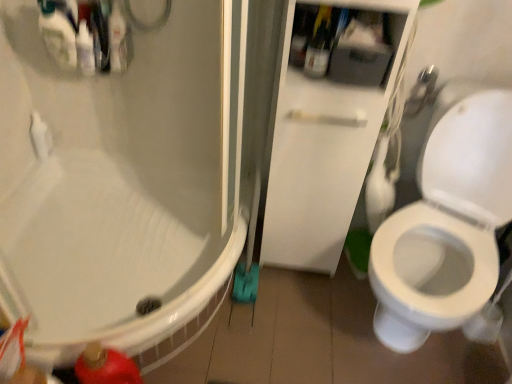
Question: Is brushed metal showerhead at upper right oriented away from translucent plastic bottle at upper center?

Choices:
 (A) no
 (B) yes

Answer: (A)

Question: Can you confirm if brushed metal showerhead at upper right is bigger than translucent plastic bottle at upper center?

Choices:
 (A) no
 (B) yes

Answer: (B)

Question: Is brushed metal showerhead at upper right far from translucent plastic bottle at upper center?

Choices:
 (A) yes
 (B) no

Answer: (B)

Question: Is brushed metal showerhead at upper right outside translucent plastic bottle at upper center?

Choices:
 (A) no
 (B) yes

Answer: (B)

Question: From the image's perspective, would you say brushed metal showerhead at upper right is positioned over translucent plastic bottle at upper center?

Choices:
 (A) yes
 (B) no

Answer: (B)

Question: Do you think translucent plastic bottles at upper left is within white glossy cabinet at center, or outside of it?

Choices:
 (A) outside
 (B) inside

Answer: (A)

Question: Is translucent plastic bottles at upper left bigger or smaller than white glossy cabinet at center?

Choices:
 (A) small
 (B) big

Answer: (A)

Question: Does point (76, 56) appear closer or farther from the camera than point (330, 218)?

Choices:
 (A) closer
 (B) farther

Answer: (A)

Question: From the image's perspective, is translucent plastic bottles at upper left located above or below white glossy cabinet at center?

Choices:
 (A) below
 (B) above

Answer: (B)

Question: From the image's perspective, is translucent plastic bottles at upper left located above or below translucent plastic bottle at upper center?

Choices:
 (A) above
 (B) below

Answer: (A)

Question: From a real-world perspective, relative to translucent plastic bottle at upper center, is translucent plastic bottles at upper left vertically above or below?

Choices:
 (A) above
 (B) below

Answer: (B)

Question: Is translucent plastic bottles at upper left bigger or smaller than translucent plastic bottle at upper center?

Choices:
 (A) big
 (B) small

Answer: (A)

Question: From their relative heights in the image, would you say translucent plastic bottles at upper left is taller or shorter than translucent plastic bottle at upper center?

Choices:
 (A) tall
 (B) short

Answer: (A)

Question: Is white glossy cabinet at center taller or shorter than translucent plastic bottles at upper left?

Choices:
 (A) short
 (B) tall

Answer: (B)

Question: In the image, is white glossy cabinet at center on the left side or the right side of translucent plastic bottles at upper left?

Choices:
 (A) right
 (B) left

Answer: (A)